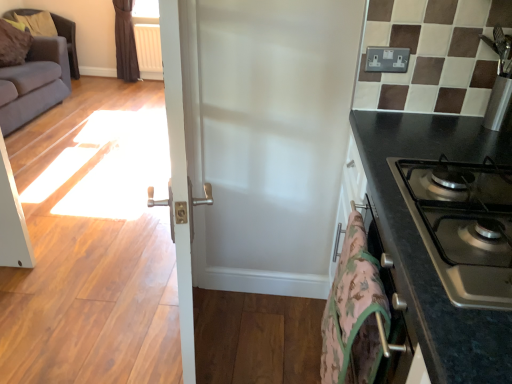
In order to face white glossy door at center, should I rotate leftwards or rightwards?

You should look left and rotate roughly 10.183 degrees.

Describe the element at coordinates (34, 83) in the screenshot. This screenshot has height=384, width=512. I see `gray fabric couch at left` at that location.

The width and height of the screenshot is (512, 384). What do you see at coordinates (463, 226) in the screenshot? I see `stainless steel gas stove at right` at bounding box center [463, 226].

You are a GUI agent. You are given a task and a screenshot of the screen. Output one action in this format:
    pyautogui.click(x=<x>, y=<y>)
    Task: Click on the black granite countertop at right
    
    Given the screenshot: What is the action you would take?
    pyautogui.click(x=423, y=244)

The width and height of the screenshot is (512, 384). I want to click on dark gray fabric armchair at upper left, so click(68, 41).

You are a GUI agent. You are given a task and a screenshot of the screen. Output one action in this format:
    pyautogui.click(x=<x>, y=<y>)
    Task: Click on the white glossy door at center
    Image resolution: width=512 pixels, height=384 pixels.
    Given the screenshot: What is the action you would take?
    pyautogui.click(x=178, y=176)

Considering the relative positions of white glossy door at center and gray fabric couch at left in the image provided, is white glossy door at center to the right of gray fabric couch at left from the viewer's perspective?

Yes, white glossy door at center is to the right of gray fabric couch at left.

Considering the positions of objects white glossy door at center and gray fabric couch at left in the image provided, who is in front, white glossy door at center or gray fabric couch at left?

white glossy door at center is closer to the camera.

Which of these two, white glossy door at center or gray fabric couch at left, is wider?

gray fabric couch at left is wider.

Is white glossy door at center beside gray fabric couch at left?

white glossy door at center is not next to gray fabric couch at left, and they're not touching.

From the image's perspective, is dark gray fabric armchair at upper left positioned above or below white plastic radiator at upper left?

From the image's perspective, dark gray fabric armchair at upper left appears below white plastic radiator at upper left.

Considering the relative positions of dark gray fabric armchair at upper left and white plastic radiator at upper left in the image provided, is dark gray fabric armchair at upper left to the right of white plastic radiator at upper left from the viewer's perspective?

In fact, dark gray fabric armchair at upper left is to the left of white plastic radiator at upper left.

Is point (78, 67) closer to camera compared to point (147, 45)?

No.

You are a GUI agent. You are given a task and a screenshot of the screen. Output one action in this format:
    pyautogui.click(x=<x>, y=<y>)
    Task: Click on the studio couch above the camouflage fabric blanket at lower right (from the image's perspective)
    This screenshot has width=512, height=384.
    Given the screenshot: What is the action you would take?
    pyautogui.click(x=34, y=83)

Looking at this image, is camouflage fabric blanket at lower right wider or thinner than gray fabric couch at left?

camouflage fabric blanket at lower right is thinner than gray fabric couch at left.

In the scene shown: Between camouflage fabric blanket at lower right and gray fabric couch at left, which one has smaller size?

camouflage fabric blanket at lower right.

Consider the image. Are camouflage fabric blanket at lower right and gray fabric couch at left making contact?

camouflage fabric blanket at lower right is not next to gray fabric couch at left, and they're not touching.

Can you confirm if gray fabric couch at left is shorter than dark gray fabric armchair at upper left?

Indeed, gray fabric couch at left has a lesser height compared to dark gray fabric armchair at upper left.

At what (x,y) coordinates should I click in order to perform the action: click on studio couch above the dark gray fabric armchair at upper left (from a real-world perspective). Please return your answer as a coordinate pair (x, y). Looking at the image, I should click on point(34,83).

How many degrees apart are the facing directions of gray fabric couch at left and dark gray fabric armchair at upper left?

gray fabric couch at left and dark gray fabric armchair at upper left are facing 4.22e-05 degrees away from each other.

From the image's perspective, between dark gray fabric armchair at upper left and black granite countertop at right, who is located below?

black granite countertop at right appears lower in the image.

Considering the relative positions of dark gray fabric armchair at upper left and black granite countertop at right in the image provided, is dark gray fabric armchair at upper left to the left of black granite countertop at right from the viewer's perspective?

Yes.

Is dark gray fabric armchair at upper left not close to black granite countertop at right?

Yes, dark gray fabric armchair at upper left and black granite countertop at right are quite far apart.

The image size is (512, 384). Identify the location of armchair on the left of the black granite countertop at right. (68, 41).

Based on their sizes in the image, would you say dark gray fabric armchair at upper left is bigger or smaller than stainless steel gas stove at right?

Clearly, dark gray fabric armchair at upper left is larger in size than stainless steel gas stove at right.

Can you tell me how much dark gray fabric armchair at upper left and stainless steel gas stove at right differ in facing direction?

179 degrees separate the facing orientations of dark gray fabric armchair at upper left and stainless steel gas stove at right.

Which of these two, dark gray fabric armchair at upper left or stainless steel gas stove at right, stands taller?

dark gray fabric armchair at upper left is taller.

Considering the positions of points (70, 57) and (400, 190), is point (70, 57) closer to camera compared to point (400, 190)?

No, it is not.

Between black granite countertop at right and gray fabric couch at left, which one is positioned in front?

Positioned in front is black granite countertop at right.

From a real-world perspective, which is physically above, black granite countertop at right or gray fabric couch at left?

black granite countertop at right.

Is black granite countertop at right with gray fabric couch at left?

No, black granite countertop at right is not beside gray fabric couch at left.

Which object is wider, black granite countertop at right or gray fabric couch at left?

→ gray fabric couch at left.

This screenshot has height=384, width=512. In the image, there is a gray fabric couch at left. What are the coordinates of `screen door below it (from the image's perspective)` in the screenshot? It's located at (178, 176).

Locate an element on the screen. Image resolution: width=512 pixels, height=384 pixels. radiator lying behind the dark gray fabric armchair at upper left is located at coordinates (148, 47).

Estimate the real-world distances between objects in this image. Which object is closer to dark gray fabric armchair at upper left, gray fabric couch at left or white plastic radiator at upper left?

gray fabric couch at left is closer to dark gray fabric armchair at upper left.

Which object lies further to the anchor point camouflage fabric blanket at lower right, stainless steel gas stove at right or dark gray fabric armchair at upper left?

dark gray fabric armchair at upper left is positioned further to the anchor camouflage fabric blanket at lower right.

Which object lies further to the anchor point gray fabric couch at left, camouflage fabric blanket at lower right or white glossy door at center?

The object further to gray fabric couch at left is camouflage fabric blanket at lower right.

Estimate the real-world distances between objects in this image. Which object is closer to camouflage fabric blanket at lower right, white glossy door at center or white plastic radiator at upper left?

Based on the image, white glossy door at center appears to be nearer to camouflage fabric blanket at lower right.

Which object lies nearer to the anchor point dark gray fabric armchair at upper left, white plastic radiator at upper left or gray fabric couch at left?

gray fabric couch at left is closer to dark gray fabric armchair at upper left.

When comparing their distances from stainless steel gas stove at right, does dark gray fabric armchair at upper left or camouflage fabric blanket at lower right seem closer?

Based on the image, camouflage fabric blanket at lower right appears to be nearer to stainless steel gas stove at right.

Consider the image. Considering their positions, is stainless steel gas stove at right positioned closer to gray fabric couch at left than camouflage fabric blanket at lower right?

Among the two, camouflage fabric blanket at lower right is located nearer to gray fabric couch at left.

Estimate the real-world distances between objects in this image. Which object is further from camouflage fabric blanket at lower right, dark gray fabric armchair at upper left or gray fabric couch at left?

dark gray fabric armchair at upper left is positioned further to the anchor camouflage fabric blanket at lower right.

What are the coordinates of `countertop between stainless steel gas stove at right and camouflage fabric blanket at lower right vertically` in the screenshot? It's located at (423, 244).

Locate an element on the screen. The height and width of the screenshot is (384, 512). gas stove located between white glossy door at center and black granite countertop at right in the left-right direction is located at coordinates (463, 226).

You are a GUI agent. You are given a task and a screenshot of the screen. Output one action in this format:
    pyautogui.click(x=<x>, y=<y>)
    Task: Click on the screen door between gray fabric couch at left and black granite countertop at right in the horizontal direction
    
    Given the screenshot: What is the action you would take?
    pyautogui.click(x=178, y=176)

I want to click on studio couch between white glossy door at center and dark gray fabric armchair at upper left in the front-back direction, so coord(34,83).